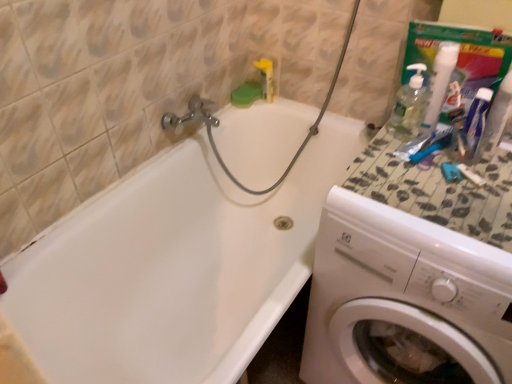
Where is `vacant area situated below speckled stone countertop at right (from a real-world perspective)`? Image resolution: width=512 pixels, height=384 pixels. vacant area situated below speckled stone countertop at right (from a real-world perspective) is located at coordinates (433, 183).